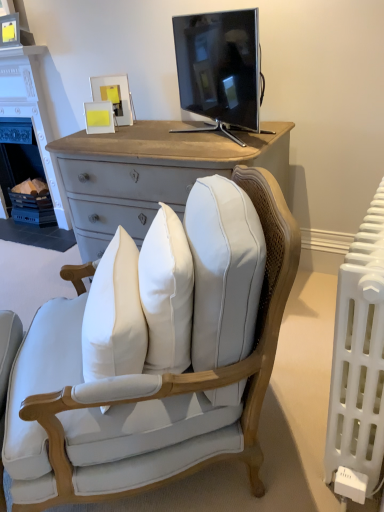
Question: From the image's perspective, does white painted wood fireplace at left appear lower than light blue fabric chair at center?

Choices:
 (A) no
 (B) yes

Answer: (A)

Question: Can you confirm if white painted wood fireplace at left is wider than light blue fabric chair at center?

Choices:
 (A) no
 (B) yes

Answer: (A)

Question: Is white painted wood fireplace at left shorter than light blue fabric chair at center?

Choices:
 (A) yes
 (B) no

Answer: (B)

Question: Considering the relative positions of white painted wood fireplace at left and light blue fabric chair at center in the image provided, is white painted wood fireplace at left to the left of light blue fabric chair at center from the viewer's perspective?

Choices:
 (A) no
 (B) yes

Answer: (B)

Question: Is white painted wood fireplace at left closer to camera compared to light blue fabric chair at center?

Choices:
 (A) yes
 (B) no

Answer: (B)

Question: Is white painted wood fireplace at left bigger than light blue fabric chair at center?

Choices:
 (A) yes
 (B) no

Answer: (B)

Question: Considering the relative sizes of white plastic radiator at right and black glossy tv at upper center in the image provided, is white plastic radiator at right bigger than black glossy tv at upper center?

Choices:
 (A) yes
 (B) no

Answer: (A)

Question: Is white plastic radiator at right positioned beyond the bounds of black glossy tv at upper center?

Choices:
 (A) yes
 (B) no

Answer: (A)

Question: Considering the relative sizes of white plastic radiator at right and black glossy tv at upper center in the image provided, is white plastic radiator at right shorter than black glossy tv at upper center?

Choices:
 (A) yes
 (B) no

Answer: (B)

Question: Is white plastic radiator at right positioned far away from black glossy tv at upper center?

Choices:
 (A) no
 (B) yes

Answer: (B)

Question: From the image's perspective, is white plastic radiator at right above black glossy tv at upper center?

Choices:
 (A) yes
 (B) no

Answer: (B)

Question: Is white plastic radiator at right with black glossy tv at upper center?

Choices:
 (A) no
 (B) yes

Answer: (A)

Question: Is the position of black glossy tv at upper center less distant than that of white plastic radiator at right?

Choices:
 (A) no
 (B) yes

Answer: (A)